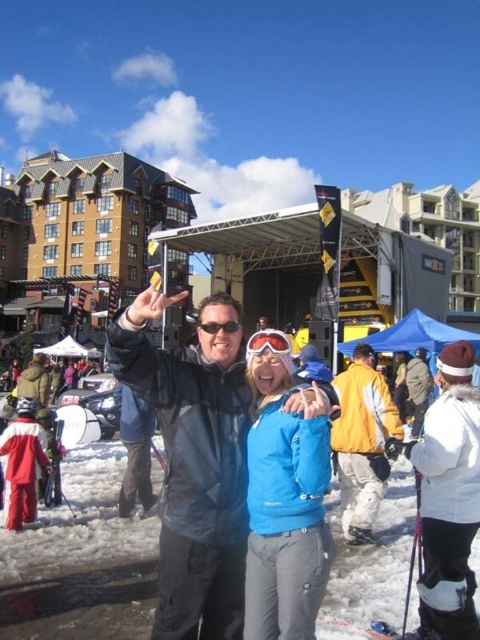
Does blue softshell jacket at center come in front of transparent plastic goggles at center?

Yes, blue softshell jacket at center is in front of transparent plastic goggles at center.

Which is above, blue softshell jacket at center or transparent plastic goggles at center?

transparent plastic goggles at center

Is point (269, 497) closer to camera compared to point (263, 337)?

That is True.

Where is `blue softshell jacket at center`? This screenshot has width=480, height=640. blue softshell jacket at center is located at coordinates (286, 502).

Does blue softshell jacket at center have a larger size compared to yellow matte jacket at center?

Actually, blue softshell jacket at center might be smaller than yellow matte jacket at center.

Which is more to the left, blue softshell jacket at center or yellow matte jacket at center?

blue softshell jacket at center is more to the left.

Locate an element on the screen. The height and width of the screenshot is (640, 480). blue softshell jacket at center is located at coordinates (286, 502).

Between matte black jacket at center and transparent plastic goggles at center, which one is positioned higher?

transparent plastic goggles at center

Between matte black jacket at center and transparent plastic goggles at center, which one appears on the right side from the viewer's perspective?

Positioned to the right is transparent plastic goggles at center.

The image size is (480, 640). What do you see at coordinates (193, 468) in the screenshot? I see `matte black jacket at center` at bounding box center [193, 468].

Locate an element on the screen. The width and height of the screenshot is (480, 640). matte black jacket at center is located at coordinates (193, 468).